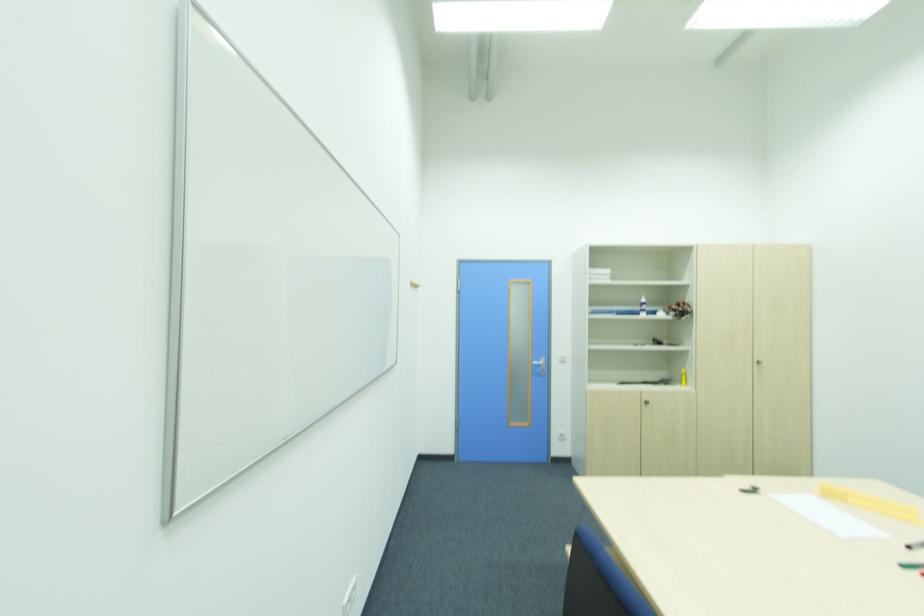
What do you see at coordinates (540, 363) in the screenshot?
I see `the silver door handle` at bounding box center [540, 363].